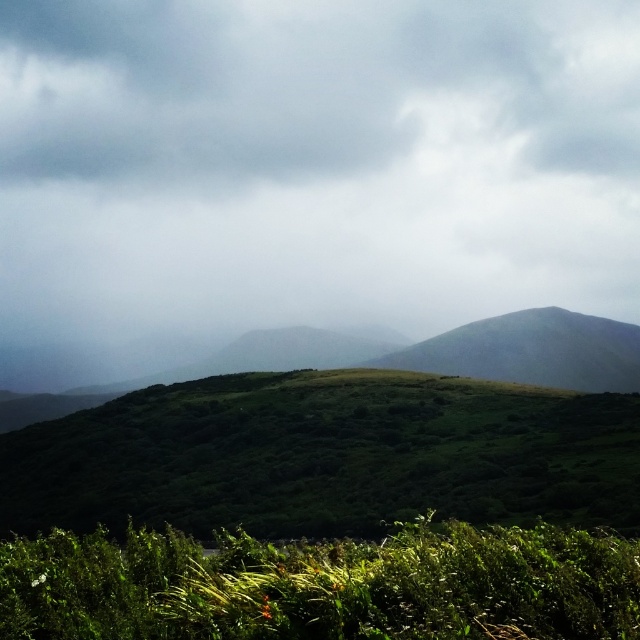
You are standing in the middle of the landscape and want to know which object occupies more horizontal space. Which one is wider between the gray cloudy sky at upper center and the green leafy grass at lower center?

The gray cloudy sky at upper center is wider than the green leafy grass at lower center according to the description.

You are standing in the middle of the landscape described. Which object is closer to you, the gray cloudy sky at upper center or the green leafy grass at lower center?

The green leafy grass at lower center is closer to you because the gray cloudy sky at upper center is further away.